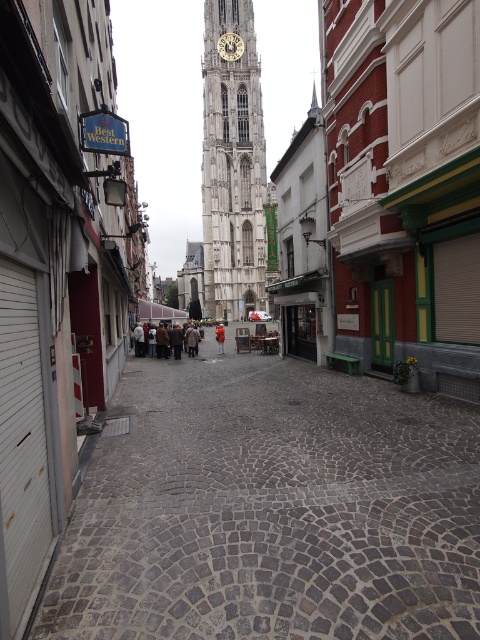
Which is more to the left, stone tower at center or brown leather jacket at center?

From the viewer's perspective, stone tower at center appears more on the left side.

Which is more to the right, stone tower at center or brown leather jacket at center?

→ brown leather jacket at center is more to the right.

You are a GUI agent. You are given a task and a screenshot of the screen. Output one action in this format:
    pyautogui.click(x=<x>, y=<y>)
    Task: Click on the stone tower at center
    Image resolution: width=480 pixels, height=640 pixels.
    Given the screenshot: What is the action you would take?
    pyautogui.click(x=58, y=273)

The width and height of the screenshot is (480, 640). What do you see at coordinates (58, 273) in the screenshot? I see `stone tower at center` at bounding box center [58, 273].

Does stone tower at center have a lesser height compared to orange fabric person at center?

No.

Is point (72, 259) closer to viewer compared to point (219, 349)?

Yes, it is.

At what (x,y) coordinates should I click in order to perform the action: click on stone tower at center. Please return your answer as a coordinate pair (x, y). The height and width of the screenshot is (640, 480). Looking at the image, I should click on (58, 273).

Is gold textured clock at center thinner than orange fabric person at center?

No, gold textured clock at center is not thinner than orange fabric person at center.

Between point (233, 49) and point (219, 349), which one is positioned in front?

Point (219, 349)

What do you see at coordinates (229, 45) in the screenshot? The height and width of the screenshot is (640, 480). I see `gold textured clock at center` at bounding box center [229, 45].

Find the location of a particular element. The width and height of the screenshot is (480, 640). gold textured clock at center is located at coordinates (229, 45).